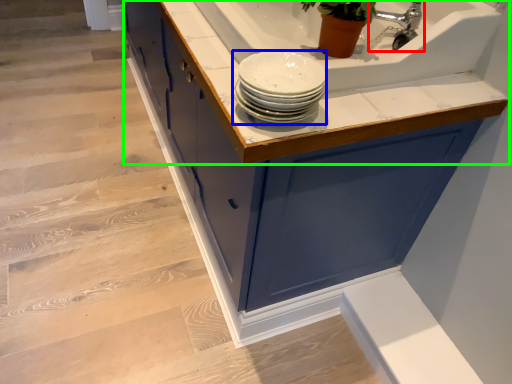
Question: Which object is the closest to the tap (highlighted by a red box)? Choose among these: tableware (highlighted by a blue box) or countertop (highlighted by a green box).

Choices:
 (A) tableware
 (B) countertop

Answer: (B)